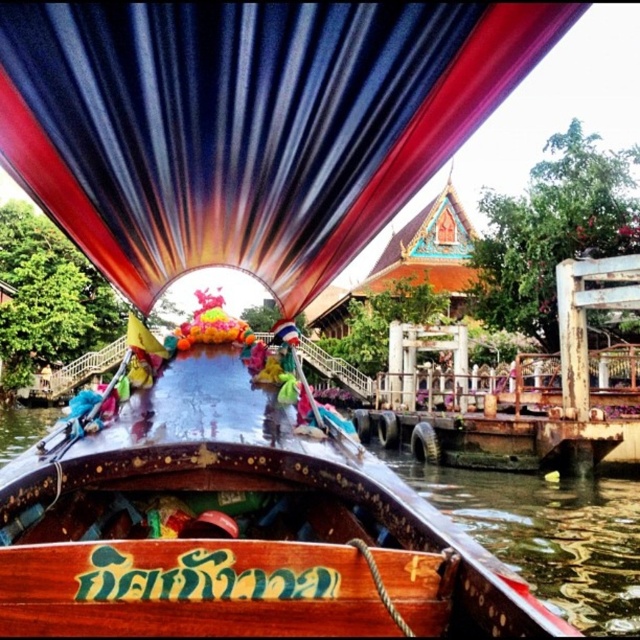
You are a photographer standing on the dock. You want to take a photo of the polished wood boat at center without the blue striped fabric canopy at center blocking the view. Is the boat visible from your current position?

The polished wood boat at center is behind the blue striped fabric canopy at center, so it is partially or fully obscured by the canopy. Adjust your position to ensure the boat is not blocked by the canopy.

You are a tourist standing on the dock and want to board the polished wood boat at center. To do so, you need to step over the blue striped fabric canopy at center. Is this possible?

The blue striped fabric canopy at center is located above the polished wood boat at center, so you can step over it to board the boat.